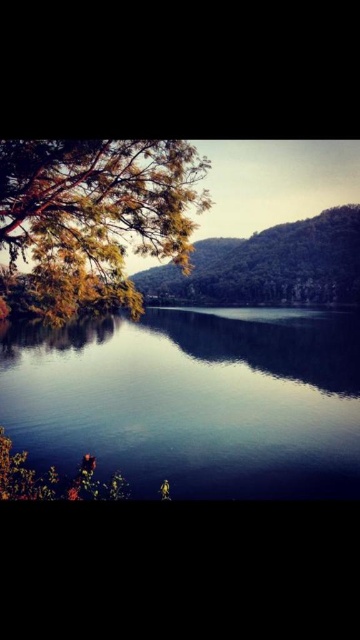
The width and height of the screenshot is (360, 640). Describe the element at coordinates (92, 218) in the screenshot. I see `green leafy tree at upper left` at that location.

Between green leafy tree at upper left and green matte tree at center, which one has more height?

Standing taller between the two is green matte tree at center.

Does point (23, 204) come farther from viewer compared to point (339, 282)?

No, (23, 204) is in front of (339, 282).

Identify the location of green leafy tree at upper left. Image resolution: width=360 pixels, height=640 pixels. (92, 218).

Who is more forward, (69, 346) or (92, 218)?

Point (92, 218) is in front.

Who is positioned more to the right, smooth reflective water at center or green leafy tree at upper left?

smooth reflective water at center

Locate an element on the screen. Image resolution: width=360 pixels, height=640 pixels. smooth reflective water at center is located at coordinates (194, 400).

Which is in front, point (276, 483) or point (254, 278)?

Point (276, 483)

Who is higher up, smooth reflective water at center or green matte tree at center?

green matte tree at center is above.

Locate an element on the screen. The width and height of the screenshot is (360, 640). smooth reflective water at center is located at coordinates (194, 400).

Locate an element on the screen. The height and width of the screenshot is (640, 360). smooth reflective water at center is located at coordinates (194, 400).